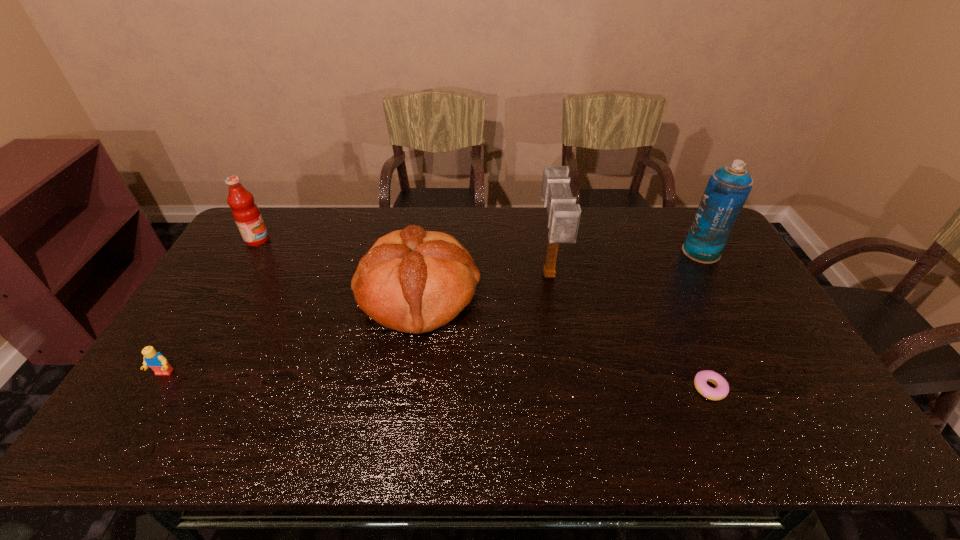
Image resolution: width=960 pixels, height=540 pixels. I want to click on aerosol can, so click(727, 190).

Locate an element on the screen. the third object from right to left is located at coordinates (564, 214).

Locate an element on the screen. The image size is (960, 540). the third tallest object is located at coordinates (246, 213).

Locate an element on the screen. the third shortest object is located at coordinates (411, 280).

Identify the location of bread. Image resolution: width=960 pixels, height=540 pixels. pos(411,280).

You are a GUI agent. You are given a task and a screenshot of the screen. Output one action in this format:
    pyautogui.click(x=<x>, y=<y>)
    Task: Click on the Lego
    
    Given the screenshot: What is the action you would take?
    pyautogui.click(x=155, y=360)

Find the location of a particular element. doughnut is located at coordinates (721, 391).

Find the location of `the second object from right to left`. the second object from right to left is located at coordinates (721, 391).

Where is `free space located on the left of the rightmost object`? free space located on the left of the rightmost object is located at coordinates (636, 252).

Image resolution: width=960 pixels, height=540 pixels. What are the coordinates of `free space located 0.380m on the left of the mallet` in the screenshot? It's located at (419, 276).